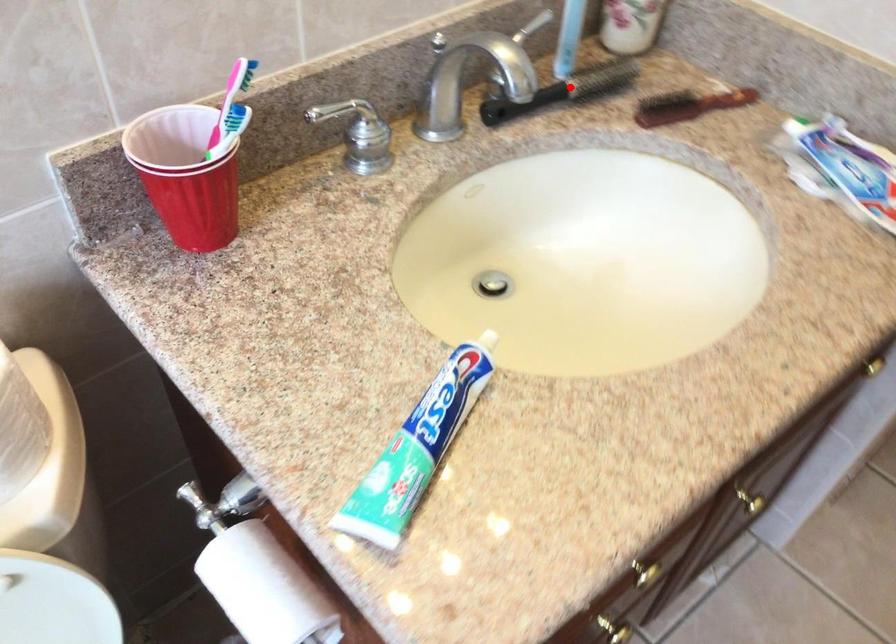
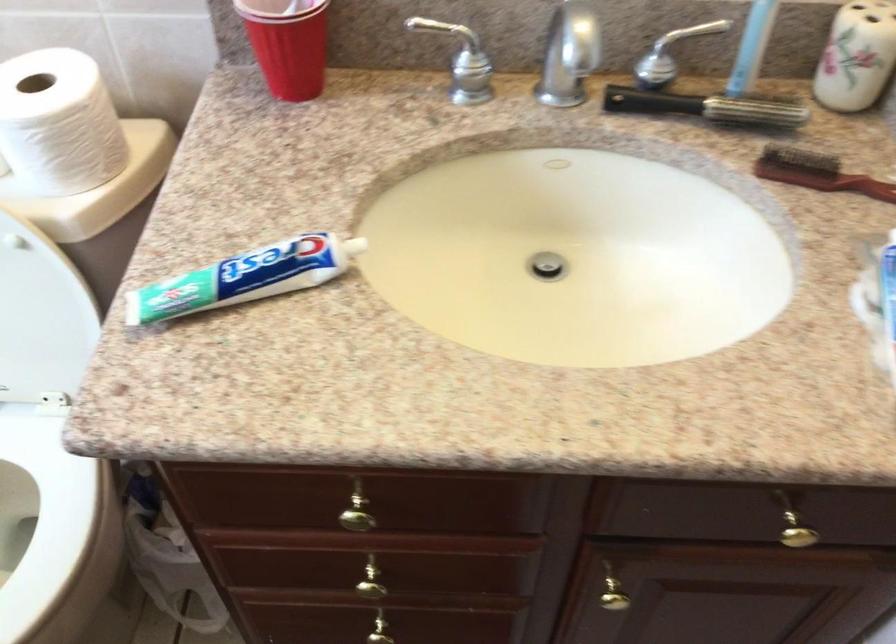
Where in the second image is the point corresponding to the highlighted location from the first image?

(707, 107)